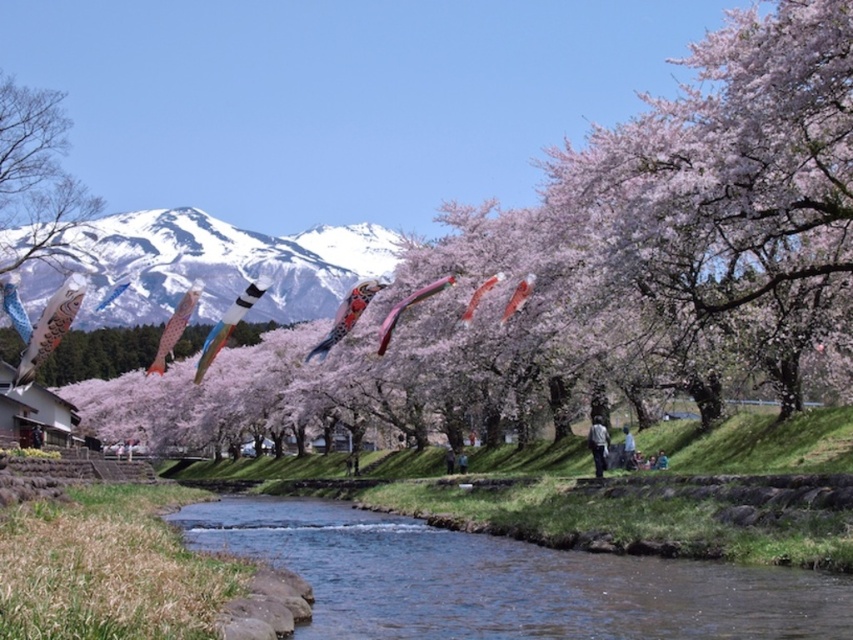
Which is more to the right, multicolored fabric kite at center or shiny red kite at center?

shiny red kite at center is more to the right.

Is multicolored fabric kite at center closer to camera compared to shiny red kite at center?

That is False.

Locate an element on the screen. The image size is (853, 640). multicolored fabric kite at center is located at coordinates (347, 314).

Does matte pink kite at center-left appear over shiny red kite at center?

Actually, matte pink kite at center-left is below shiny red kite at center.

Measure the distance between point (161, 355) and camera.

Point (161, 355) is 593.26 feet from camera.

In order to click on matte pink kite at center-left in this screenshot , I will do `click(175, 326)`.

Can you confirm if snowy white mountain at upper center is positioned above multicolored fabric kite at center?

Correct, snowy white mountain at upper center is located above multicolored fabric kite at center.

Can you confirm if snowy white mountain at upper center is bigger than multicolored fabric kite at center?

Correct, snowy white mountain at upper center is larger in size than multicolored fabric kite at center.

Which is in front, point (300, 244) or point (311, 355)?

Positioned in front is point (311, 355).

Locate an element on the screen. snowy white mountain at upper center is located at coordinates (209, 266).